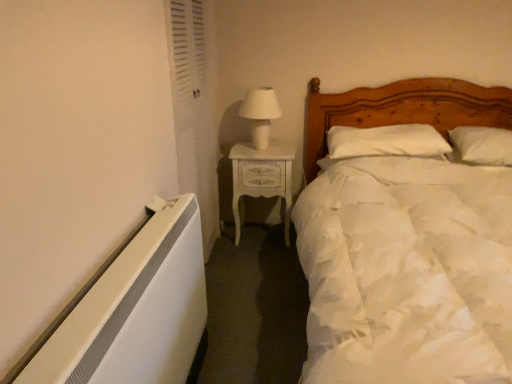
Question: Would you say white soft pillow at upper right, the 1th pillow in the right-to-left sequence, is to the left or to the right of white painted wood nightstand at center in the picture?

Choices:
 (A) right
 (B) left

Answer: (A)

Question: From a real-world perspective, is white soft pillow at upper right, which is the second pillow in left-to-right order, physically located above or below white painted wood nightstand at center?

Choices:
 (A) below
 (B) above

Answer: (B)

Question: Estimate the real-world distances between objects in this image. Which object is closer to the white soft pillow at center, which is counted as the second pillow, starting from the right?

Choices:
 (A) white soft bed at right
 (B) white soft pillow at upper right, which is the second pillow in left-to-right order
 (C) white glossy table lamp at upper center
 (D) white louvered door at left
 (E) white painted wood nightstand at center

Answer: (A)

Question: Based on their relative distances, which object is nearer to the white soft bed at right?

Choices:
 (A) white soft pillow at upper right, the 1th pillow in the right-to-left sequence
 (B) white louvered door at left
 (C) white glossy table lamp at upper center
 (D) white soft pillow at center, which is counted as the second pillow, starting from the right
 (E) white painted wood nightstand at center

Answer: (D)